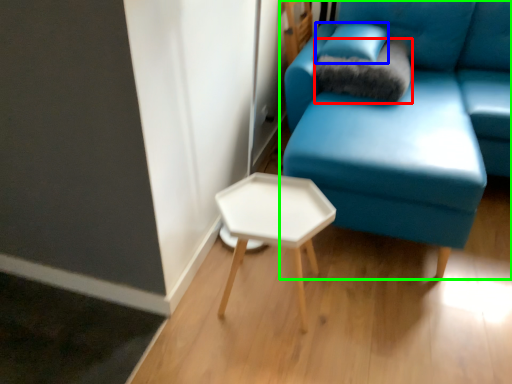
Question: Which is farther away from pillow (highlighted by a red box)? pillow (highlighted by a blue box) or studio couch (highlighted by a green box)?

Choices:
 (A) pillow
 (B) studio couch

Answer: (B)